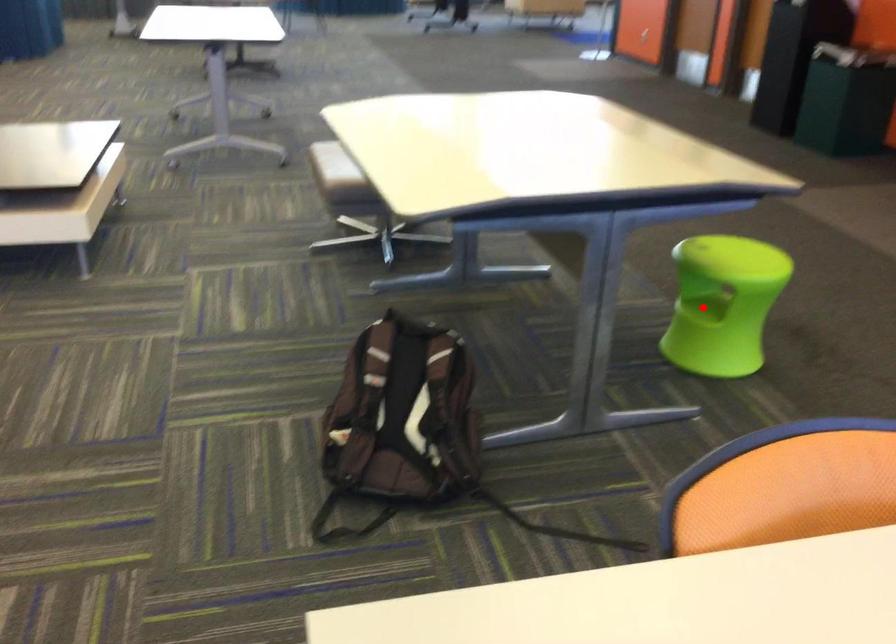
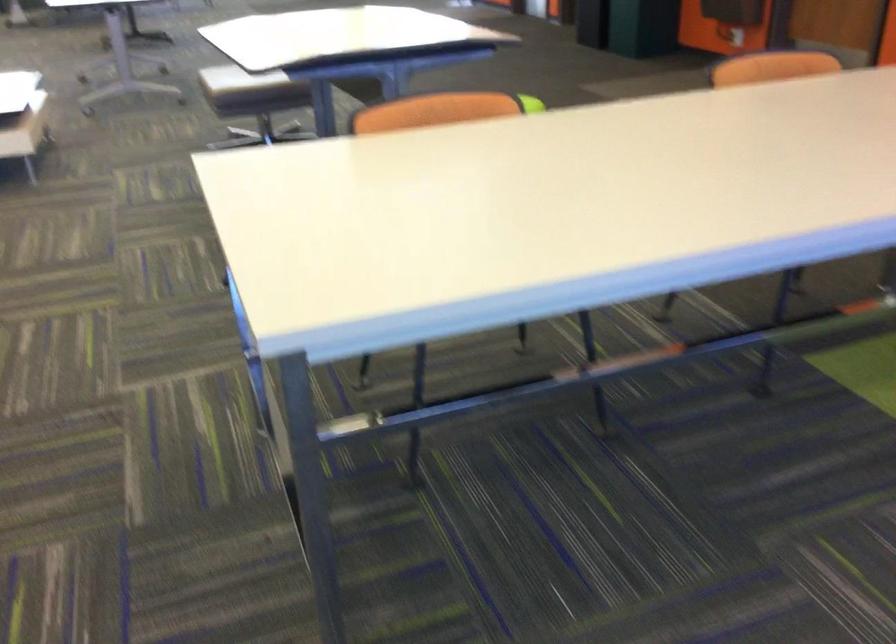
Question: I am providing you with two images of the same scene from different viewpoints. A red point is marked on the first image. Can you still see the location of the red point in image 2?

Choices:
 (A) Yes
 (B) No

Answer: (B)